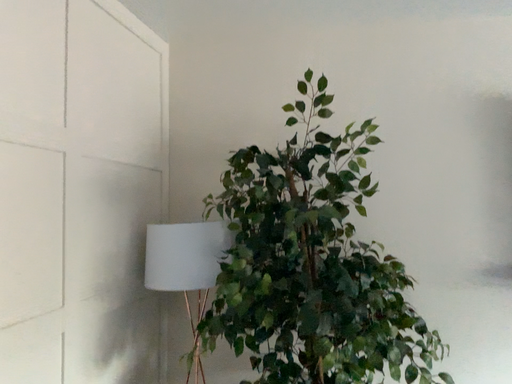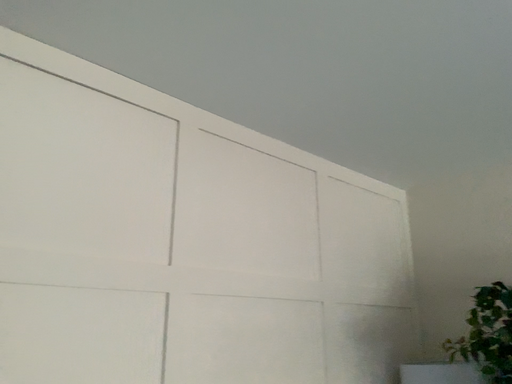
Question: Which way did the camera rotate in the video?

Choices:
 (A) rotated downward
 (B) rotated upward

Answer: (B)